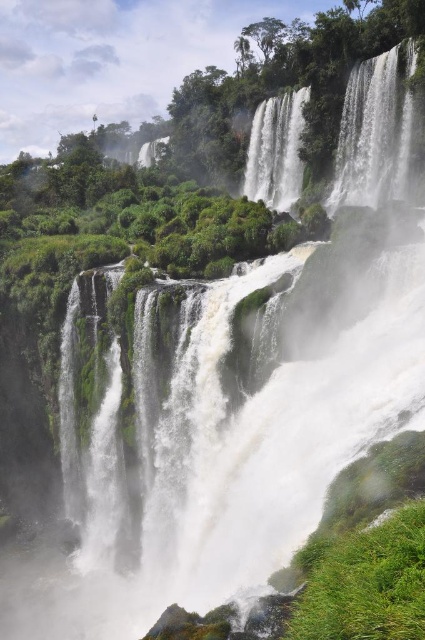
You are a photographer standing at the base of the waterfall. You want to capture a closeup shot of the white frothy water at upper right. Given that your camera has a 100mm lens, which has a maximum focusing distance of 100 feet, can you take the photo without moving closer?

The white frothy water at upper right is 191.39 feet away from the camera. Since the maximum focusing distance of the 100mm lens is 100 feet, the camera cannot focus on the subject at that distance. You would need to move closer or use a lens with a longer maximum focusing distance to capture the closeup.

You are a hiker who wants to cross the valley using a narrow path that runs between the white frothy water at upper right and the white frothy water at center. The path is 40 feet wide. Do you think you can safely walk through this path without getting too close to either waterfall?

The distance between the white frothy water at upper right and the white frothy water at center is 41.33 feet, which is wider than the 40 feet path. Therefore, you can safely walk through the path as there is enough space between both waterfalls to avoid getting too close.